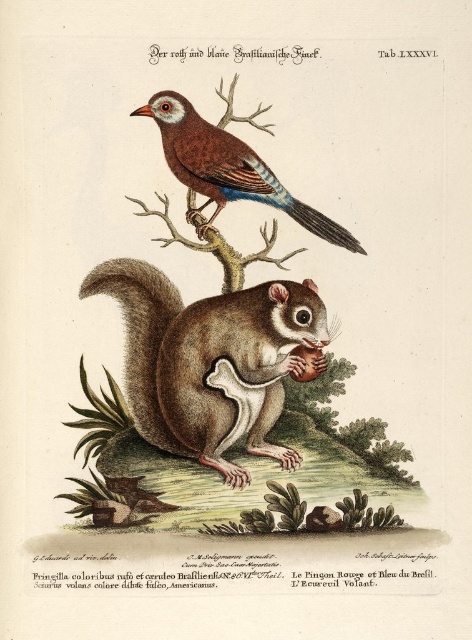
Can you confirm if smooth brown squirrel at center is taller than brown furry squirrel at lower center?

Indeed, smooth brown squirrel at center has a greater height compared to brown furry squirrel at lower center.

Which is more to the left, smooth brown squirrel at center or brown furry squirrel at lower center?

smooth brown squirrel at center

I want to click on smooth brown squirrel at center, so click(x=227, y=412).

Which is more to the left, smooth brown squirrel at center or brown glossy bird at upper center?

Answer: smooth brown squirrel at center is more to the left.

Is smooth brown squirrel at center above brown glossy bird at upper center?

No.

Identify the location of smooth brown squirrel at center. The width and height of the screenshot is (472, 640). (227, 412).

Does brown furry squirrel at lower center appear on the right side of brown glossy bird at upper center?

No, brown furry squirrel at lower center is not to the right of brown glossy bird at upper center.

I want to click on brown furry squirrel at lower center, so (x=210, y=360).

Where is `brown furry squirrel at lower center`? brown furry squirrel at lower center is located at coordinates coord(210,360).

This screenshot has height=640, width=472. I want to click on brown furry squirrel at lower center, so click(x=210, y=360).